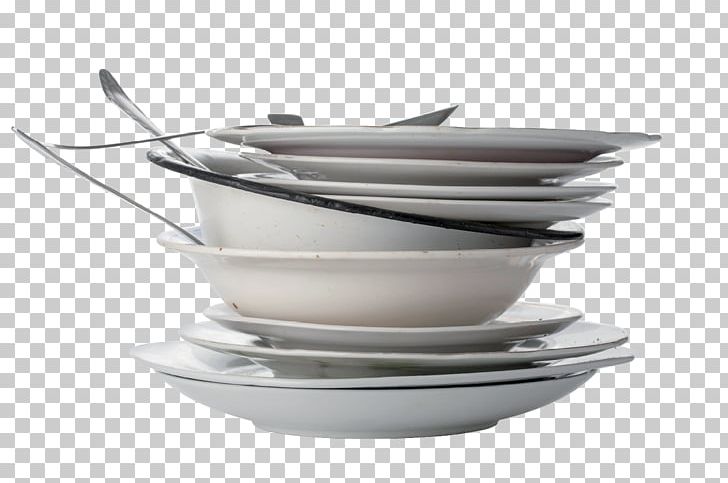
Locate an element on the screen. The image size is (728, 483). plates and bowls in a stack is located at coordinates (x=424, y=407), (x=423, y=377), (x=423, y=359), (x=424, y=343), (x=416, y=296), (x=416, y=223), (x=426, y=211), (x=426, y=194), (x=427, y=177), (x=424, y=149).